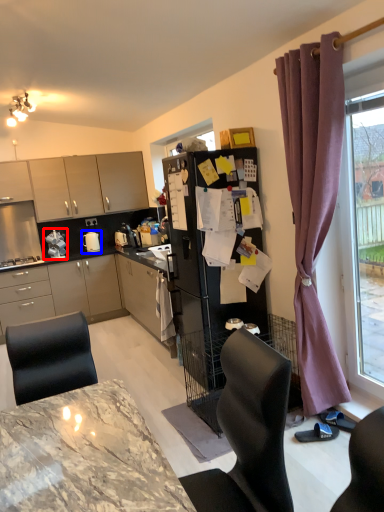
Question: Which point is closer to the camera, appliance (highlighted by a red box) or appliance (highlighted by a blue box)?

Choices:
 (A) appliance
 (B) appliance

Answer: (A)